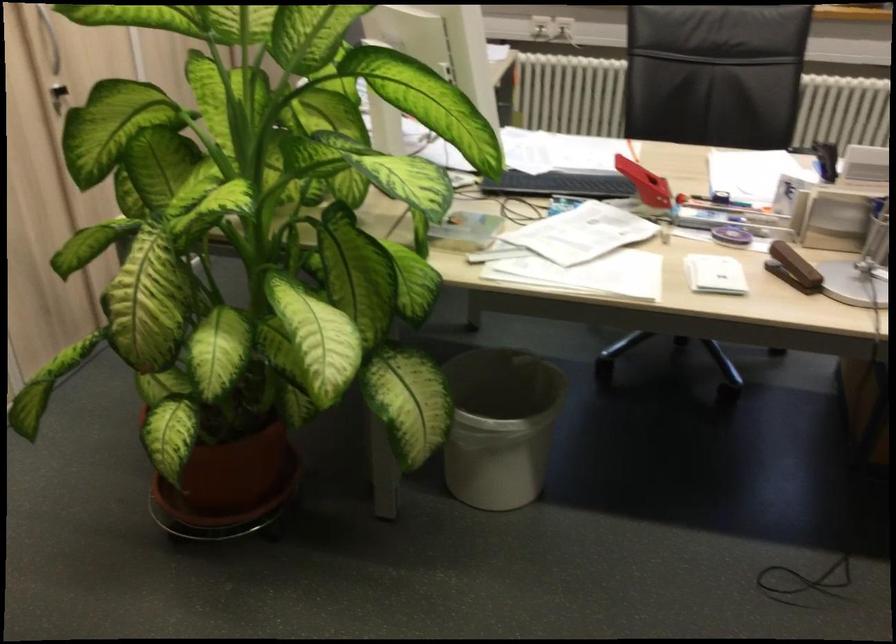
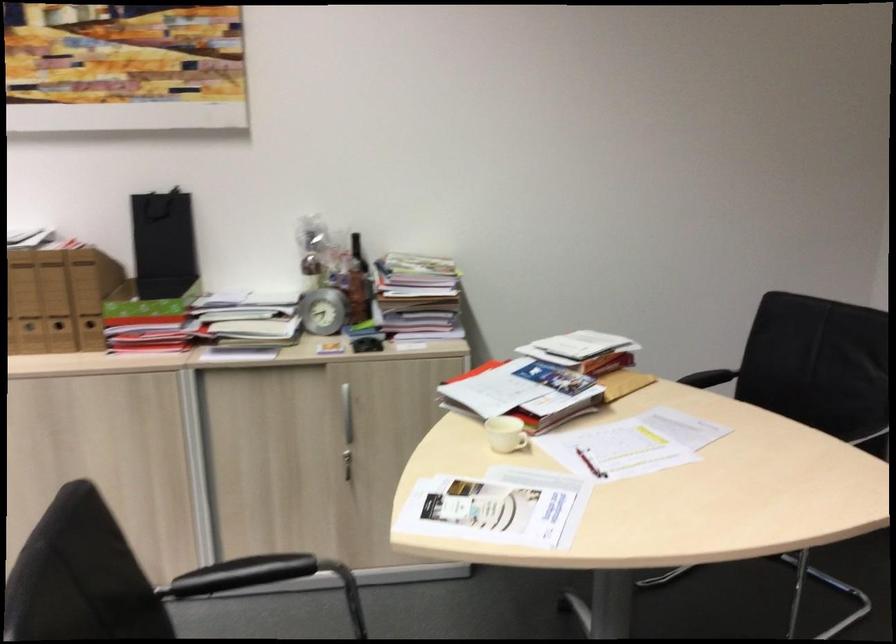
First-person continuous shooting, in which direction is the camera rotating?

The camera's rotation is toward right-down.